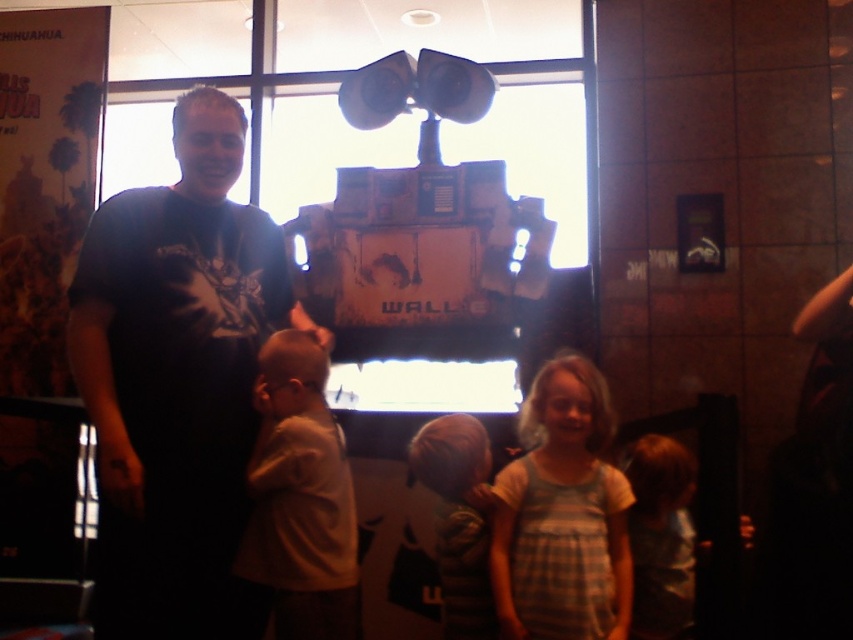
Question: Is plaid fabric dress at center to the right of light brown fabric shirt at lower right from the viewer's perspective?

Choices:
 (A) yes
 (B) no

Answer: (B)

Question: Observing the image, what is the correct spatial positioning of plaid fabric dress at center in reference to light brown fabric shirt at lower right?

Choices:
 (A) left
 (B) right

Answer: (A)

Question: Is black matte shirt at left positioned before light brown fabric shirt at lower right?

Choices:
 (A) no
 (B) yes

Answer: (B)

Question: Among these objects, which one is farthest from the camera?

Choices:
 (A) light brown fabric shirt at lower right
 (B) striped fabric shirt at center
 (C) light brown fabric shirt at lower left

Answer: (B)

Question: Which point is closer to the camera?

Choices:
 (A) striped fabric shirt at center
 (B) black matte shirt at left

Answer: (B)

Question: Which object is positioned farthest from the striped fabric shirt at center?

Choices:
 (A) black matte shirt at left
 (B) light brown fabric shirt at lower right
 (C) light brown fabric shirt at lower left
 (D) plaid fabric dress at center

Answer: (A)